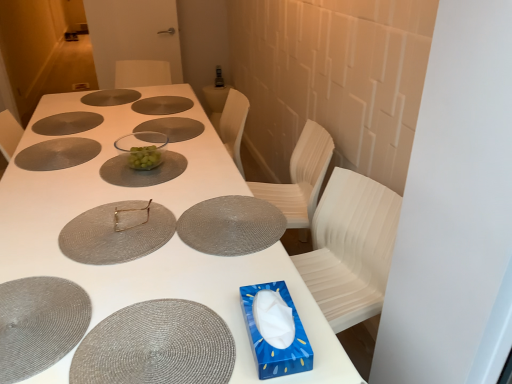
Find the location of a particular element. This screenshot has width=512, height=384. free area in between matte gray glass plate at upper left, which is the 5th glass plate in back-to-front order, and transparent glass bowl at center is located at coordinates (100, 153).